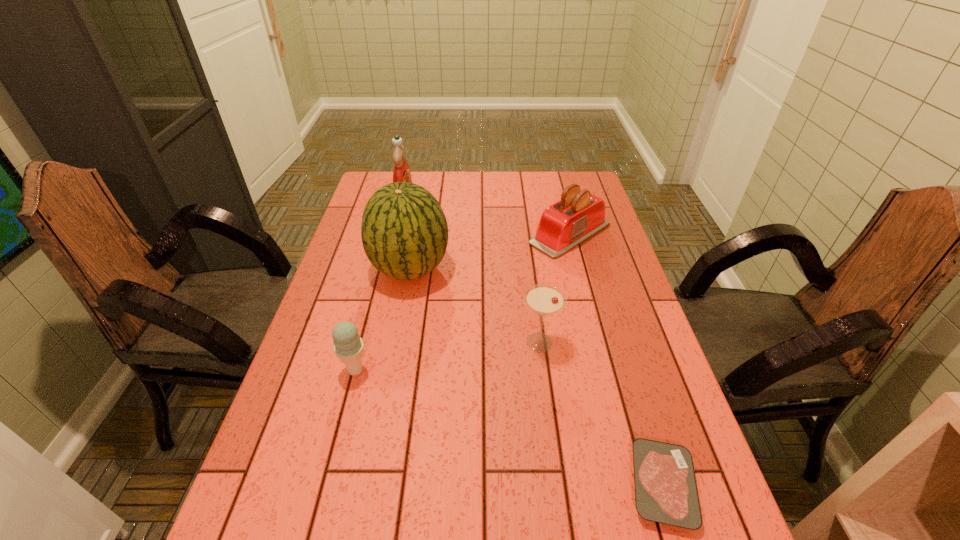
In order to click on watermelon in this screenshot , I will do `click(404, 231)`.

Identify the location of detergent. (401, 173).

Locate an element on the screen. toaster is located at coordinates (579, 215).

This screenshot has width=960, height=540. In order to click on the third nearest object in this screenshot , I will do `click(544, 299)`.

This screenshot has height=540, width=960. Identify the location of ice cream. (348, 346).

Image resolution: width=960 pixels, height=540 pixels. What are the coordinates of `the nearest object` in the screenshot? It's located at (666, 492).

Where is `steak`? This screenshot has height=540, width=960. steak is located at coordinates (666, 492).

At what (x,y) coordinates should I click in order to perform the action: click on vacant position located on the front of the watermelon. Please return your answer as a coordinate pair (x, y). Looking at the image, I should click on (401, 315).

Where is `free region located 0.240m on the front surface of the detergent`? This screenshot has width=960, height=540. free region located 0.240m on the front surface of the detergent is located at coordinates (479, 202).

I want to click on vacant area located 0.290m on the left of the toaster, so pyautogui.click(x=441, y=234).